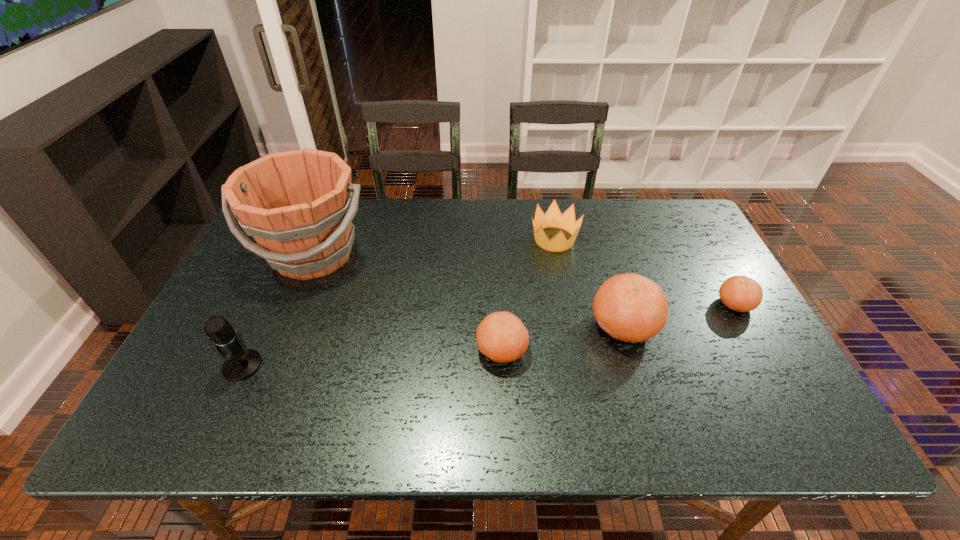
The width and height of the screenshot is (960, 540). What are the coordinates of `microphone at the left edge` in the screenshot? It's located at (239, 364).

You are a GUI agent. You are given a task and a screenshot of the screen. Output one action in this format:
    pyautogui.click(x=<x>, y=<y>)
    Task: Click on the object present at the right edge
    
    Given the screenshot: What is the action you would take?
    pyautogui.click(x=739, y=293)

Identify the location of object at the far left corner. (298, 205).

The width and height of the screenshot is (960, 540). I want to click on object located in the near left corner section of the desktop, so click(239, 364).

In the image, there is a desktop. What are the coordinates of `free space at the far edge` in the screenshot? It's located at (604, 243).

In the image, there is a desktop. At what (x,y) coordinates should I click in order to perform the action: click on vacant space at the near edge. Please return your answer as a coordinate pair (x, y). The width and height of the screenshot is (960, 540). Looking at the image, I should click on (652, 369).

Find the location of a particular element. Image resolution: width=960 pixels, height=540 pixels. vacant area at the left edge of the desktop is located at coordinates (271, 285).

Identify the location of vacant region at the right edge of the desktop. (713, 262).

What are the coordinates of `empty space that is in between the third object from left to right and the microphone` in the screenshot? It's located at (372, 357).

This screenshot has width=960, height=540. I want to click on vacant area that lies between the leftmost clementine and the tallest object, so click(408, 302).